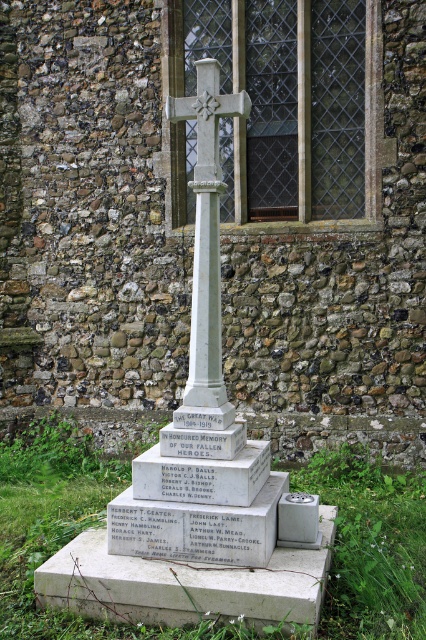
Question: Among these objects, which one is farthest from the camera?

Choices:
 (A) gray stone cross at center
 (B) white stone cross at center

Answer: (B)

Question: Is gray stone cross at center below white stone cross at center?

Choices:
 (A) yes
 (B) no

Answer: (A)

Question: Does gray stone cross at center lie in front of white stone cross at center?

Choices:
 (A) yes
 (B) no

Answer: (A)

Question: Which point is farther to the camera?

Choices:
 (A) (210, 184)
 (B) (218, 312)

Answer: (B)

Question: Which point is closer to the camera?

Choices:
 (A) (218, 65)
 (B) (175, 413)

Answer: (B)

Question: Is gray stone cross at center thinner than white stone cross at center?

Choices:
 (A) no
 (B) yes

Answer: (A)